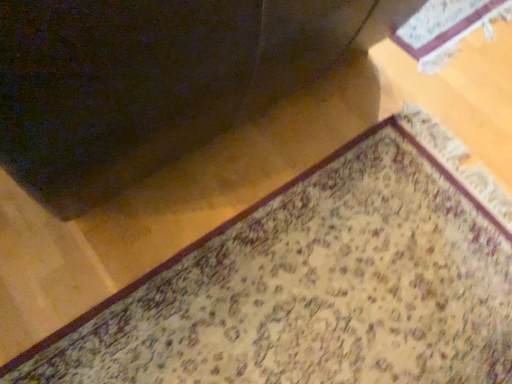
Where is `patterned carpet at lower right`? The width and height of the screenshot is (512, 384). patterned carpet at lower right is located at coordinates (320, 283).

What do you see at coordinates (320, 283) in the screenshot? I see `patterned carpet at lower right` at bounding box center [320, 283].

The height and width of the screenshot is (384, 512). In order to click on patterned carpet at lower right in this screenshot , I will do `click(320, 283)`.